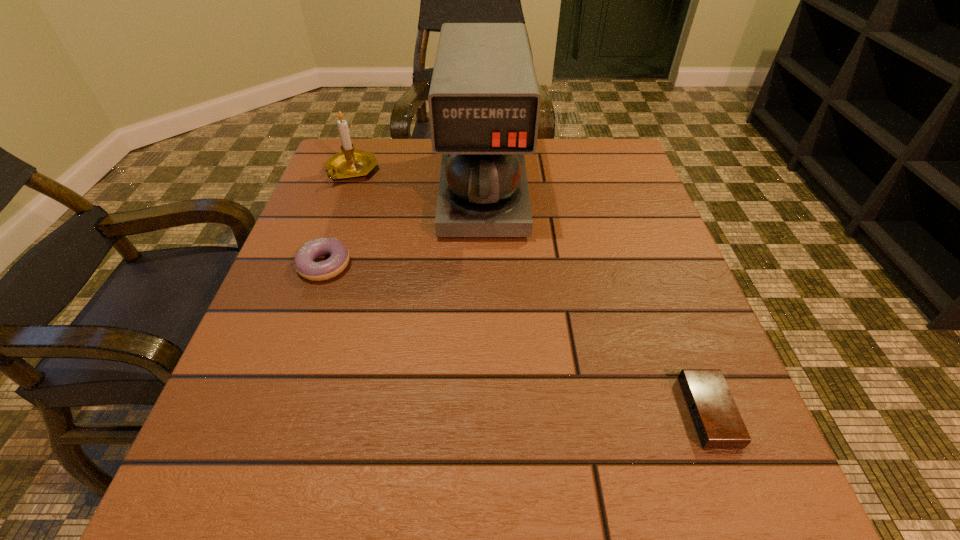
The width and height of the screenshot is (960, 540). What are the coordinates of `vacant area that lies between the nearest object and the second tallest object` in the screenshot? It's located at (530, 292).

Where is `vacant space that is in between the second nearest object and the alarm clock`? The height and width of the screenshot is (540, 960). vacant space that is in between the second nearest object and the alarm clock is located at coordinates (516, 339).

Locate an element on the screen. Image resolution: width=960 pixels, height=540 pixels. free space between the second object from right to left and the nearest object is located at coordinates click(x=595, y=301).

I want to click on empty location between the shortest object and the candle holder, so click(x=530, y=292).

What are the coordinates of `free point between the third farthest object and the nearest object` in the screenshot? It's located at (516, 339).

In order to click on the second closest object to the coffee maker in this screenshot , I will do `click(304, 264)`.

The image size is (960, 540). In order to click on object that stands as the third closest to the candle holder in this screenshot , I will do `click(715, 416)`.